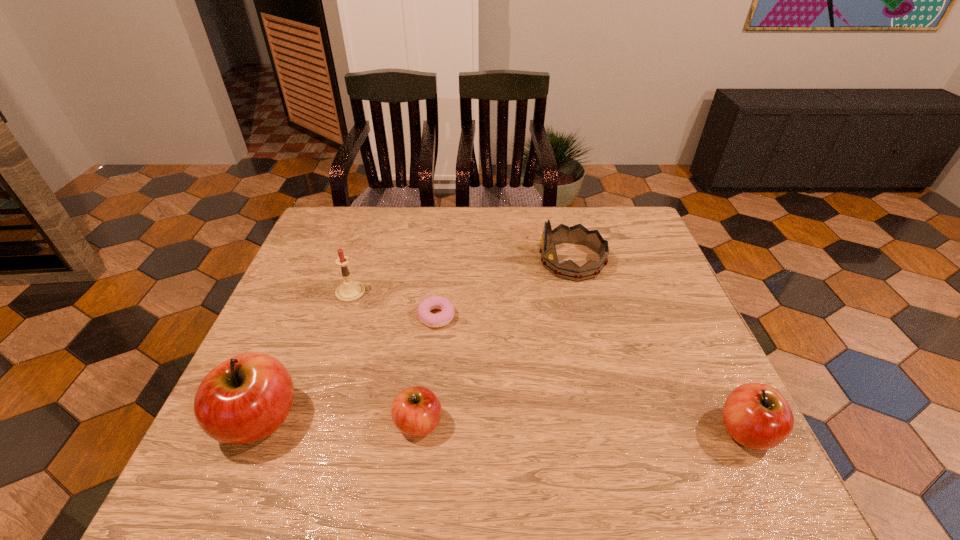
You are a GUI agent. You are given a task and a screenshot of the screen. Output one action in this format:
    pyautogui.click(x=<x>, y=<y>)
    Task: Click on the free space between the second shortest object and the candle
    
    Given the screenshot: What is the action you would take?
    pyautogui.click(x=385, y=357)

At what (x,y) coordinates should I click in order to perform the action: click on free space between the third shortest object and the second object from right to left. Please return your answer as a coordinate pair (x, y). Image resolution: width=960 pixels, height=540 pixels. Looking at the image, I should click on click(659, 346).

Where is `vacant space in between the leftmost apple and the candle`? This screenshot has height=540, width=960. vacant space in between the leftmost apple and the candle is located at coordinates (304, 356).

Locate an element on the screen. free space between the candle and the shortest apple is located at coordinates (385, 357).

Find the location of `vacant space in between the rightmost apple and the tiara`. vacant space in between the rightmost apple and the tiara is located at coordinates (659, 346).

The height and width of the screenshot is (540, 960). I want to click on free point between the second apple from left to right and the candle, so click(385, 357).

Find the location of a particular element. The width and height of the screenshot is (960, 540). unoccupied position between the tallest apple and the candle is located at coordinates (304, 356).

The width and height of the screenshot is (960, 540). I want to click on empty location between the shortest object and the rightmost object, so click(591, 374).

Locate an element on the screen. This screenshot has width=960, height=540. free area in between the shortest object and the tallest apple is located at coordinates click(x=348, y=368).

Locate an element on the screen. The image size is (960, 540). object that is the second closest to the fifth object from left to right is located at coordinates (757, 416).